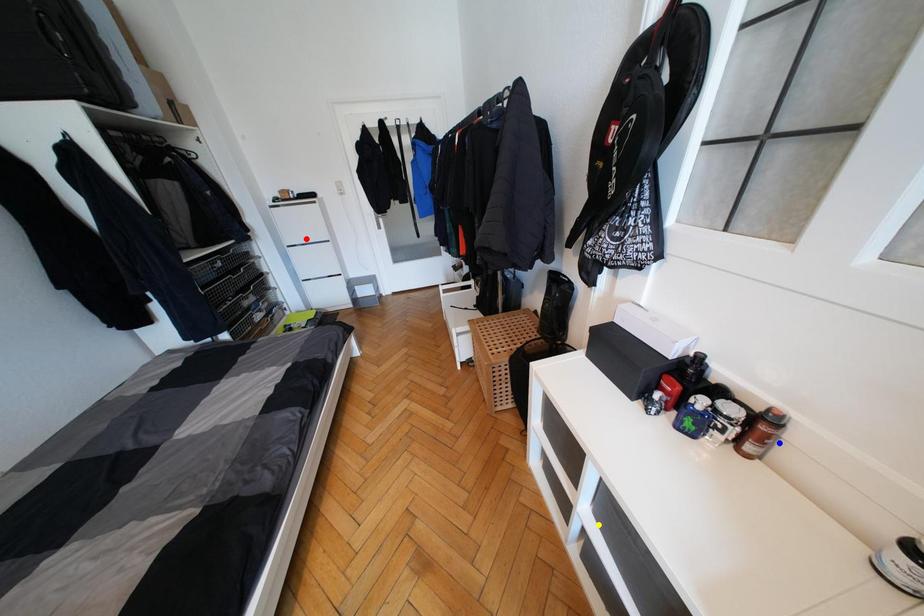
Order these from nearest to farthest:
- yellow point
- blue point
- red point

blue point
yellow point
red point